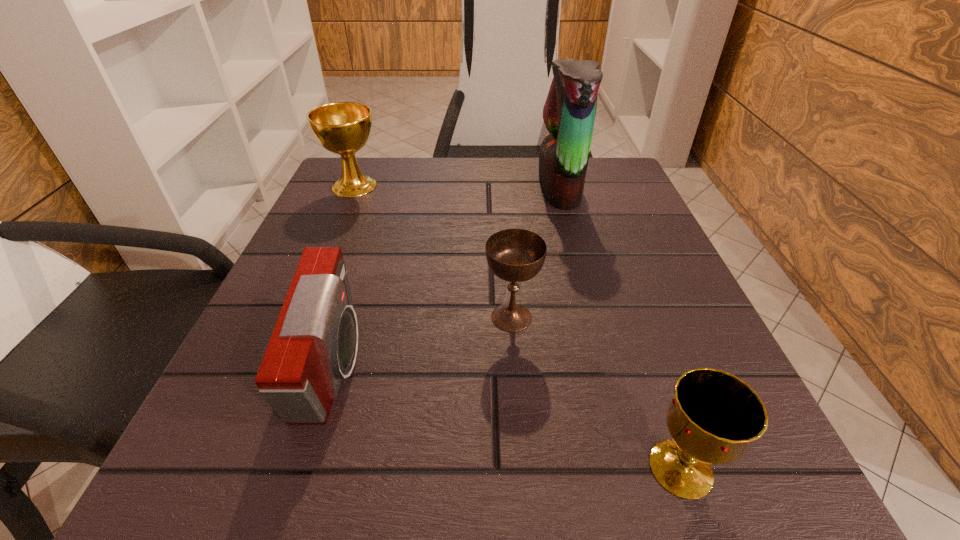
Identify the location of the tallest object. The height and width of the screenshot is (540, 960). (569, 112).

Where is `the fourth shortest object`? The width and height of the screenshot is (960, 540). the fourth shortest object is located at coordinates (343, 128).

Where is `the farthest chalice`? This screenshot has width=960, height=540. the farthest chalice is located at coordinates (343, 128).

The width and height of the screenshot is (960, 540). What are the coordinates of `the second chalice from left to right` in the screenshot? It's located at [515, 255].

You are a GUI agent. You are given a task and a screenshot of the screen. Output one action in this format:
    pyautogui.click(x=<x>, y=<y>)
    Task: Click on the third object from right to left
    
    Given the screenshot: What is the action you would take?
    [x=515, y=255]

This screenshot has height=540, width=960. Find the location of `camera`. camera is located at coordinates point(314,344).

Locate an element on the screen. Image resolution: width=960 pixels, height=540 pixels. the nearest chalice is located at coordinates (714, 415).

Where is `vacant space located 0.330m at the face of the parrot`? This screenshot has height=540, width=960. vacant space located 0.330m at the face of the parrot is located at coordinates (392, 188).

Where is `vacant area located 0.220m at the face of the parrot`? vacant area located 0.220m at the face of the parrot is located at coordinates (441, 188).

Where is `free space located at the face of the parrot`? free space located at the face of the parrot is located at coordinates (481, 188).